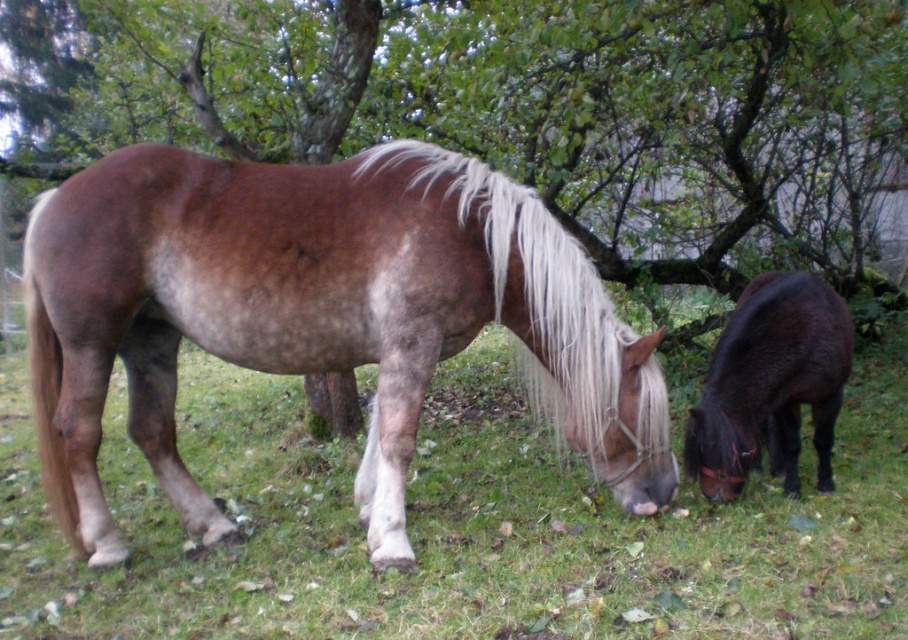
Which is more to the right, brown matte horse at center or shiny dark brown pony at lower right?

From the viewer's perspective, shiny dark brown pony at lower right appears more on the right side.

Is point (395, 436) closer to camera compared to point (772, 433)?

That is True.

Find the location of `brown matte horse at center`. brown matte horse at center is located at coordinates (316, 316).

Is green grass at center to the left of brown matte horse at center from the viewer's perspective?

Yes, green grass at center is to the left of brown matte horse at center.

Is green grass at center smaller than brown matte horse at center?

Yes.

Locate an element on the screen. green grass at center is located at coordinates (459, 525).

Does green grass at center have a lesser height compared to shiny dark brown pony at lower right?

Correct, green grass at center is not as tall as shiny dark brown pony at lower right.

Locate an element on the screen. green grass at center is located at coordinates pyautogui.click(x=459, y=525).